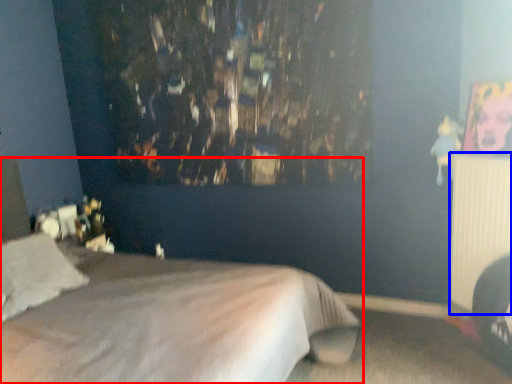
Question: Which point is closer to the camera, bed (highlighted by a red box) or radiator (highlighted by a blue box)?

Choices:
 (A) bed
 (B) radiator

Answer: (A)